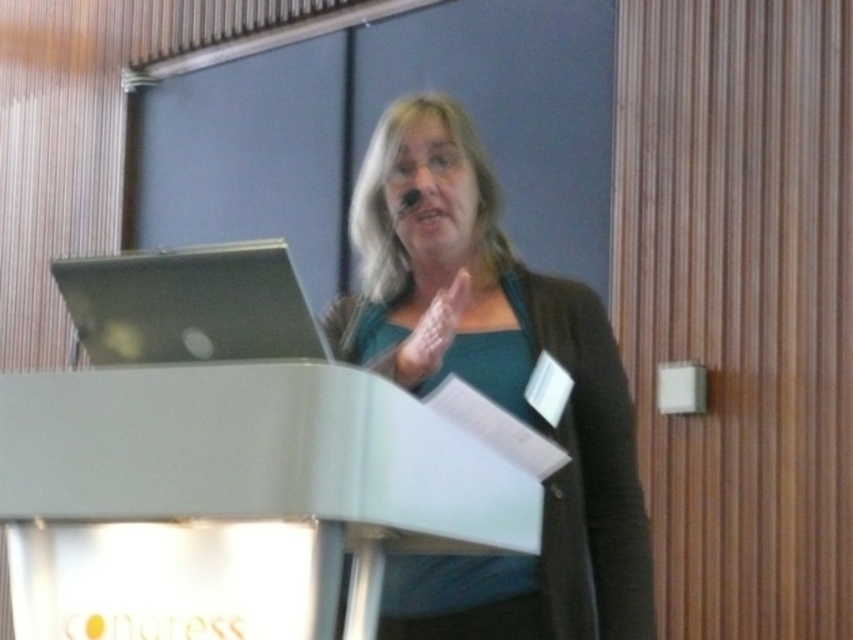
You are an event organizer who needs to adjust the microphone placement for the speaker. The microphone is currently attached to the speaker. You want to move it to the podium. Which side of the white plastic podium at center should you place the microphone so it is closest to the teal fabric shirt at center?

The teal fabric shirt at center is positioned on the right side of the white plastic podium at center. Therefore, placing the microphone on the right side of the white plastic podium at center would position it closest to the teal fabric shirt at center.

You are a photographer setting up for a presentation. You need to ensure that the teal fabric shirt at center and the white plastic podium at center are in focus simultaneously. Given that the depth of field can cover objects within 20 inches of each other, will both be in focus?

The teal fabric shirt at center is 20.20 inches from the white plastic podium at center. Since the depth of field can cover objects within 20 inches, the distance between them exceeds this limit by 0.20 inches, so both cannot be in focus simultaneously.

You are attending a presentation and need to locate the speaker. Where is the white plastic podium at center positioned in the image?

The white plastic podium at center is located at point coordinates of (256, 454).